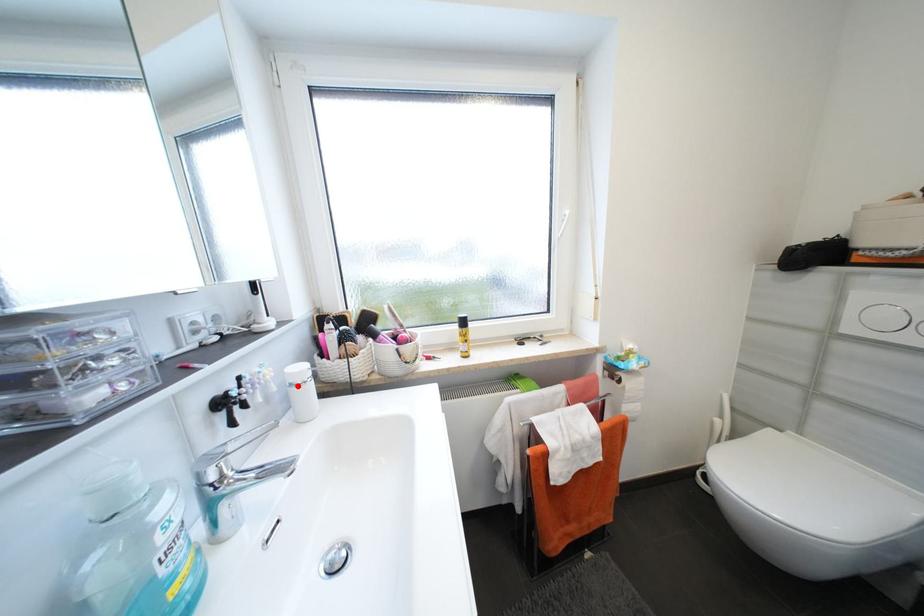
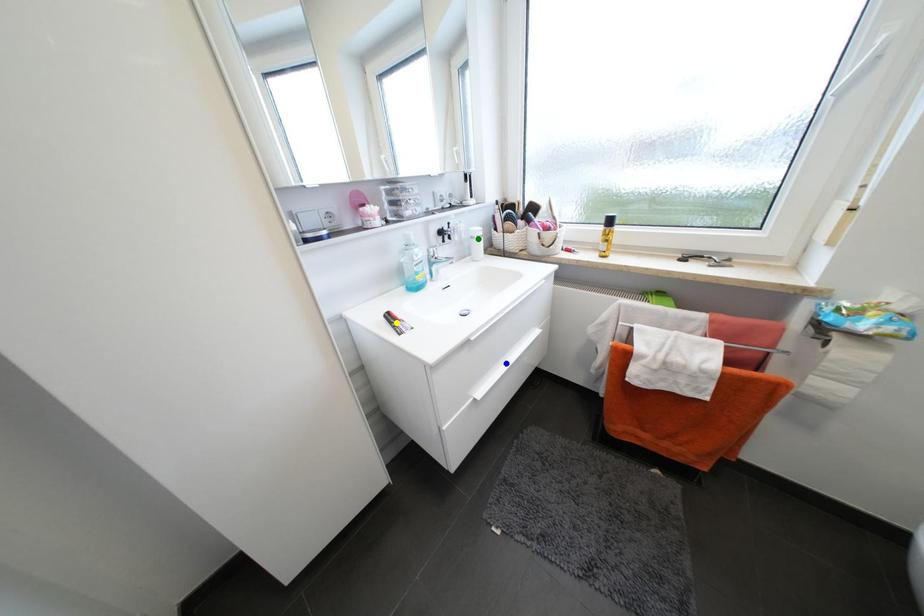
Question: I am providing you with two images of the same scene from different viewpoints. A red point is marked on the first image. You are given multiple points on the second image. Can you choose the point in image 2 that corresponds to the point in image 1?

Choices:
 (A) yellow point
 (B) blue point
 (C) green point

Answer: (C)